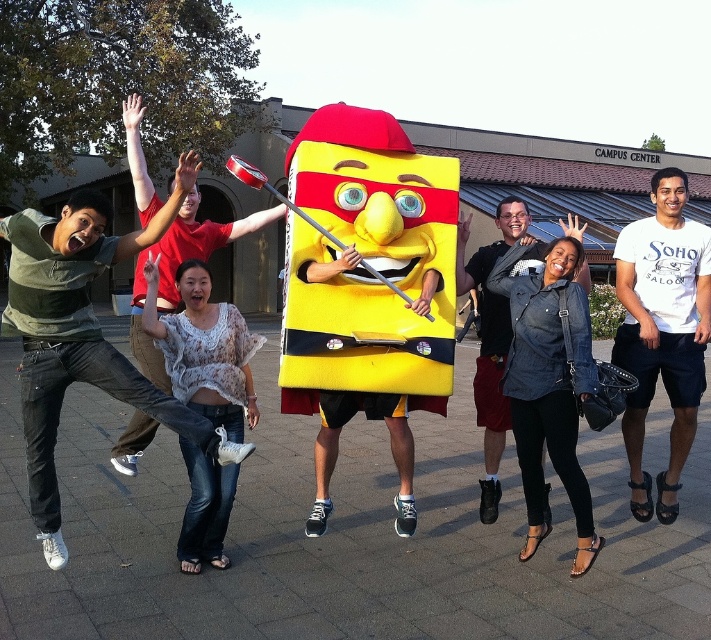
Does yellow matte costume at center have a larger size compared to denim jacket at center?

Yes.

Based on the photo, is yellow matte costume at center closer to camera compared to denim jacket at center?

Yes, yellow matte costume at center is closer to the viewer.

You are a GUI agent. You are given a task and a screenshot of the screen. Output one action in this format:
    pyautogui.click(x=<x>, y=<y>)
    Task: Click on the yellow matte costume at center
    The image size is (711, 640).
    Given the screenshot: What is the action you would take?
    pyautogui.click(x=352, y=131)

Locate an element on the screen. Image resolution: width=711 pixels, height=640 pixels. yellow matte costume at center is located at coordinates (x=352, y=131).

Between white cotton t-shirt at center and yellow matte costume at center, which one has less height?

yellow matte costume at center

Which is more to the right, white cotton t-shirt at center or yellow matte costume at center?

Positioned to the right is white cotton t-shirt at center.

Is point (651, 298) more distant than point (419, 308)?

Yes, it is.

The height and width of the screenshot is (640, 711). I want to click on white cotton t-shirt at center, so click(x=662, y=332).

Which is more to the left, white cotton t-shirt at center or denim jacket at center?

denim jacket at center is more to the left.

Can you confirm if white cotton t-shirt at center is positioned below denim jacket at center?

Incorrect, white cotton t-shirt at center is not positioned below denim jacket at center.

Is point (630, 259) positioned before point (502, 298)?

Yes, it is.

Identify the location of white cotton t-shirt at center. (662, 332).